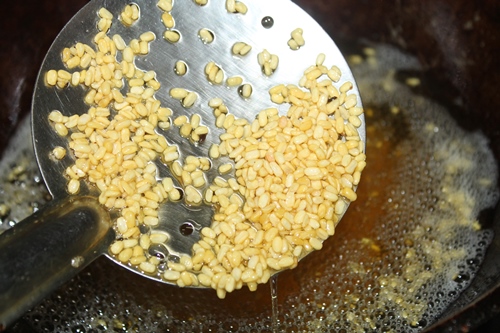
Locate an element on the screen. Image resolution: width=500 pixels, height=333 pixels. silver pan is located at coordinates (239, 32).